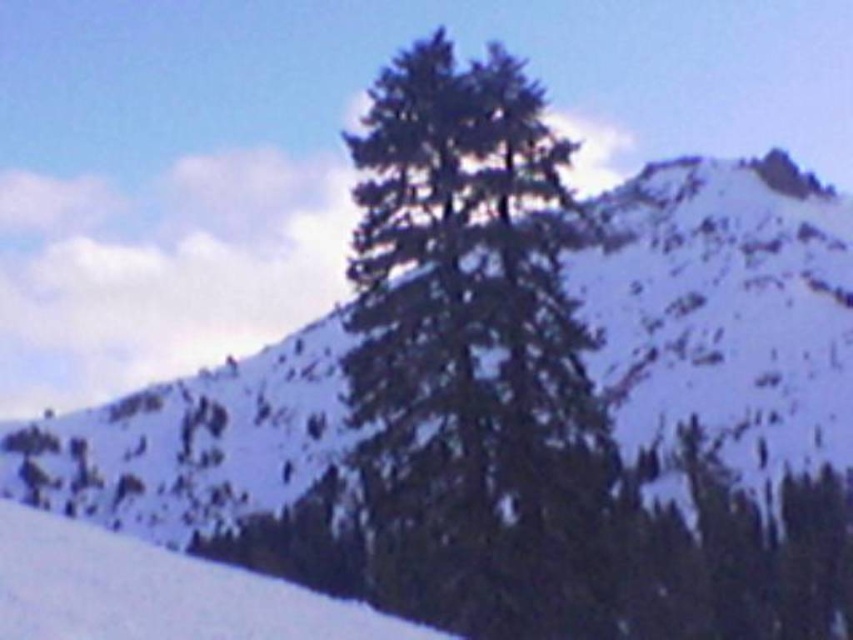
You are an outdoor photographer planning to capture the winter landscape. You want to ensure that the green textured tree at center and the white snow at lower left are both visible in your shot. Given their sizes, which object should you focus on to frame the composition effectively?

The green textured tree at center is larger in size than the white snow at lower left, so you should focus on framing the composition around the larger green textured tree at center to ensure both elements are visible while maintaining balance.

You are an artist trying to paint this winter scene. You have a canvas that can only accommodate objects up to the size of the white snow at lower left. Will the green textured tree at center fit on your canvas?

The green textured tree at center is wider than the white snow at lower left, so it will not fit on the canvas designed for the size of the white snow at lower left.

You are a hiker planning to cross the snow at lower left. You need to know if the green textured tree at center is taller than the white snow at lower left to estimate the visibility. Can you tell me which one is taller?

The green textured tree at center is taller than the white snow at lower left, so the tree will likely block some of the view when you are on the snow.